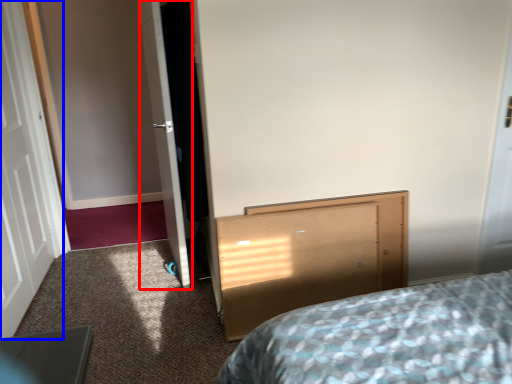
Question: Which of the following is the closest to the observer, door (highlighted by a red box) or door (highlighted by a blue box)?

Choices:
 (A) door
 (B) door

Answer: (B)